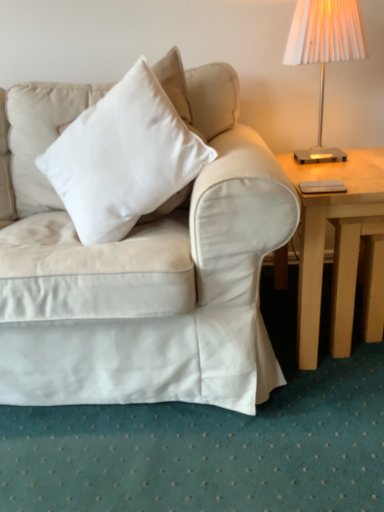
Image resolution: width=384 pixels, height=512 pixels. I want to click on metallic silver lampshade at upper right, so click(324, 52).

Measure the distance between metallic silver lampshade at upper right and camera.

metallic silver lampshade at upper right and camera are 3.73 feet apart.

This screenshot has width=384, height=512. Describe the element at coordinates (154, 281) in the screenshot. I see `satin white couch at center` at that location.

The height and width of the screenshot is (512, 384). What are the coordinates of `light wood table at right` in the screenshot? It's located at (340, 250).

Is satin white couch at center taller or shorter than metallic silver lampshade at upper right?

satin white couch at center is taller than metallic silver lampshade at upper right.

From the image's perspective, is satin white couch at center positioned above or below metallic silver lampshade at upper right?

Based on their image positions, satin white couch at center is located beneath metallic silver lampshade at upper right.

In the image, is satin white couch at center positioned in front of or behind metallic silver lampshade at upper right?

satin white couch at center is in front of metallic silver lampshade at upper right.

Does satin white couch at center turn towards metallic silver lampshade at upper right?

No, satin white couch at center is not facing towards metallic silver lampshade at upper right.

Could you tell me if white soft cushion at upper left is facing light wood table at right?

No, white soft cushion at upper left is not aimed at light wood table at right.

From a real-world perspective, is white soft cushion at upper left positioned under light wood table at right based on gravity?

Actually, white soft cushion at upper left is physically above light wood table at right in the real world.

Which object is positioned more to the right, white soft cushion at upper left or light wood table at right?

light wood table at right is more to the right.

In the scene shown: Which is farther from the camera, [146,134] or [339,293]?

Positioned behind is point [339,293].

Can you confirm if metallic silver lampshade at upper right is positioned to the right of satin white couch at center?

Yes.

Can you tell me how much metallic silver lampshade at upper right and satin white couch at center differ in facing direction?

The facing directions of metallic silver lampshade at upper right and satin white couch at center are 28.9 degrees apart.

Which object is further away from the camera taking this photo, metallic silver lampshade at upper right or satin white couch at center?

metallic silver lampshade at upper right is further away from the camera.

The width and height of the screenshot is (384, 512). In order to click on studio couch on the left of metallic silver lampshade at upper right in this screenshot , I will do `click(154, 281)`.

Do you think light wood table at right is within metallic silver lampshade at upper right, or outside of it?

The correct answer is: outside.

What's the angular difference between light wood table at right and metallic silver lampshade at upper right's facing directions?

3.35e-05 degrees.

Which object is wider, light wood table at right or metallic silver lampshade at upper right?

With larger width is light wood table at right.

Is light wood table at right behind metallic silver lampshade at upper right?

No, light wood table at right is closer to the viewer.

I want to click on studio couch that is in front of the light wood table at right, so click(x=154, y=281).

Is light wood table at right directly adjacent to satin white couch at center?

No, light wood table at right is not touching satin white couch at center.

Which object is further away from the camera, light wood table at right or satin white couch at center?

light wood table at right is further away from the camera.

From a real-world perspective, is light wood table at right physically above satin white couch at center?

No, from a real-world perspective, light wood table at right is not over satin white couch at center

From the image's perspective, which one is positioned higher, white soft cushion at upper left or metallic silver lampshade at upper right?

From the image's view, metallic silver lampshade at upper right is above.

Is white soft cushion at upper left taller than metallic silver lampshade at upper right?

Indeed, white soft cushion at upper left has a greater height compared to metallic silver lampshade at upper right.

Does point (129, 92) come behind point (353, 42)?

That is False.

Consider the image. Measure the distance from white soft cushion at upper left to metallic silver lampshade at upper right.

22.70 inches.

Is light wood table at right turned away from white soft cushion at upper left?

No, light wood table at right is not facing the opposite direction of white soft cushion at upper left.

From a real-world perspective, which is physically above, light wood table at right or white soft cushion at upper left?

From a 3D spatial view, white soft cushion at upper left is above.

Is light wood table at right directly adjacent to white soft cushion at upper left?

No, light wood table at right is not next to white soft cushion at upper left.

Is light wood table at right smaller than white soft cushion at upper left?

No, light wood table at right is not smaller than white soft cushion at upper left.

Locate an element on the screen. The image size is (384, 512). lamp above the satin white couch at center (from a real-world perspective) is located at coordinates (324, 52).

Find the location of a particular element. pillow that is in front of the light wood table at right is located at coordinates (123, 158).

In the scene shown: Based on their spatial positions, is light wood table at right or satin white couch at center closer to white soft cushion at upper left?

satin white couch at center lies closer to white soft cushion at upper left than the other object.

Considering their positions, is metallic silver lampshade at upper right positioned closer to light wood table at right than white soft cushion at upper left?

Among the two, white soft cushion at upper left is located nearer to light wood table at right.

Looking at this image, based on their spatial positions, is metallic silver lampshade at upper right or satin white couch at center further from white soft cushion at upper left?

metallic silver lampshade at upper right lies further to white soft cushion at upper left than the other object.

Looking at the image, which one is located closer to satin white couch at center, white soft cushion at upper left or metallic silver lampshade at upper right?

Among the two, white soft cushion at upper left is located nearer to satin white couch at center.

From the picture: Based on their spatial positions, is white soft cushion at upper left or satin white couch at center further from metallic silver lampshade at upper right?

satin white couch at center lies further to metallic silver lampshade at upper right than the other object.

Which object lies nearer to the anchor point metallic silver lampshade at upper right, light wood table at right or white soft cushion at upper left?

The object closer to metallic silver lampshade at upper right is light wood table at right.

Estimate the real-world distances between objects in this image. Which object is closer to white soft cushion at upper left, metallic silver lampshade at upper right or light wood table at right?

Among the two, light wood table at right is located nearer to white soft cushion at upper left.

Considering their positions, is satin white couch at center positioned further to light wood table at right than white soft cushion at upper left?

white soft cushion at upper left is further to light wood table at right.

The width and height of the screenshot is (384, 512). Identify the location of lamp between white soft cushion at upper left and light wood table at right in the horizontal direction. (324, 52).

Locate an element on the screen. This screenshot has height=512, width=384. pillow between satin white couch at center and light wood table at right from left to right is located at coordinates (123, 158).

This screenshot has height=512, width=384. I want to click on lamp between satin white couch at center and light wood table at right in the horizontal direction, so click(x=324, y=52).

Find the location of `pillow situated between satin white couch at center and metallic silver lampshade at upper right from left to right`. pillow situated between satin white couch at center and metallic silver lampshade at upper right from left to right is located at coordinates (123, 158).